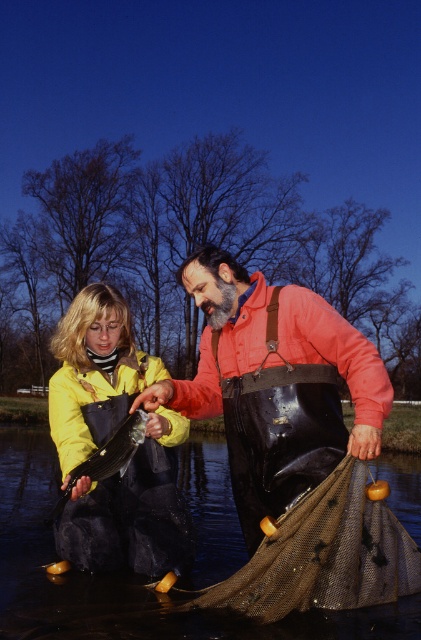
Can you confirm if black rubber boots at lower center is taller than shiny silver fish at center?

Correct, black rubber boots at lower center is much taller as shiny silver fish at center.

Is black rubber boots at lower center in front of shiny silver fish at center?

That is True.

Between point (109, 595) and point (80, 464), which one is positioned behind?

The point (109, 595) is more distant.

At what (x,y) coordinates should I click in order to perform the action: click on black rubber boots at lower center. Please return your answer as a coordinate pair (x, y). Image resolution: width=421 pixels, height=640 pixels. Looking at the image, I should click on (127, 579).

Is yellow matte jacket at center shorter than brown mesh net at lower center?

No.

Who is more forward, (165, 538) or (373, 548)?

Point (373, 548) is more forward.

In order to click on yellow matte jacket at center in this screenshot , I will do `click(133, 512)`.

What do you see at coordinates (276, 384) in the screenshot? The image size is (421, 640). I see `rubber waders at center` at bounding box center [276, 384].

Find the location of `rubber waders at center`. rubber waders at center is located at coordinates (276, 384).